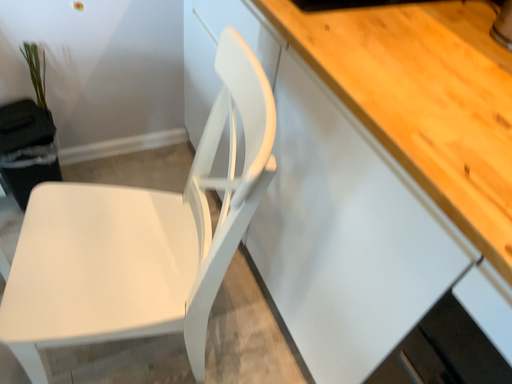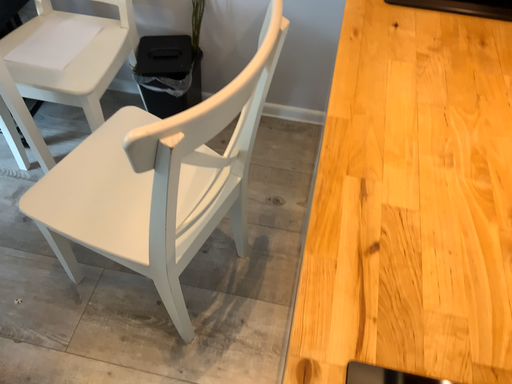
Question: How did the camera likely rotate when shooting the video?

Choices:
 (A) rotated left
 (B) rotated right

Answer: (A)